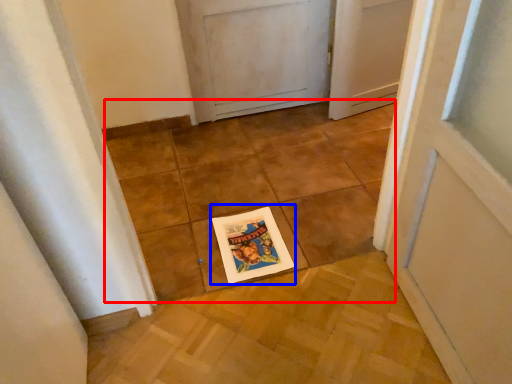
Question: Among these objects, which one is farthest to the camera, tile (highlighted by a red box) or postcard (highlighted by a blue box)?

Choices:
 (A) tile
 (B) postcard

Answer: (B)